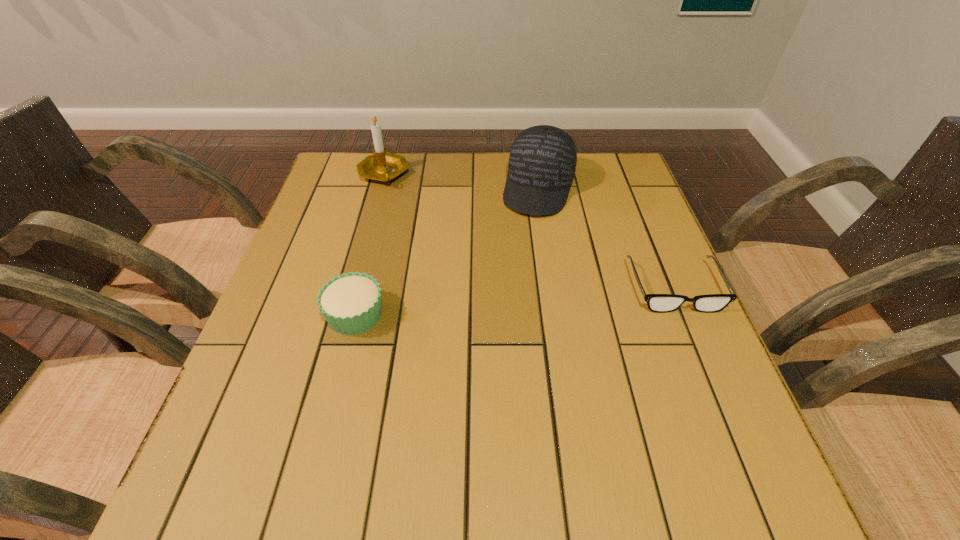
Where is `free space between the spectacles and the candle holder`? free space between the spectacles and the candle holder is located at coordinates (529, 231).

This screenshot has width=960, height=540. In order to click on free area in between the shortest object and the second shortest object in this screenshot , I will do `click(515, 301)`.

This screenshot has width=960, height=540. I want to click on vacant area between the candle holder and the second object from right to left, so click(x=461, y=181).

Where is `free space between the spectacles and the candle holder`? free space between the spectacles and the candle holder is located at coordinates (529, 231).

This screenshot has width=960, height=540. I want to click on unoccupied area between the rightmost object and the second shortest object, so click(x=515, y=301).

Find the location of a particular element. object that is the third closest to the shortest object is located at coordinates (382, 166).

Identify which object is the second closest to the rightmost object. Please provide its 2D coordinates. Your answer should be formatted as a tuple, i.e. [(x, y)], where the tuple contains the x and y coordinates of a point satisfying the conditions above.

[(351, 303)]

Find the location of a particular element. free space in the image that satisfies the following two spatial constraints: 1. on the back side of the cupcake; 2. on the right side of the baseball cap is located at coordinates (387, 188).